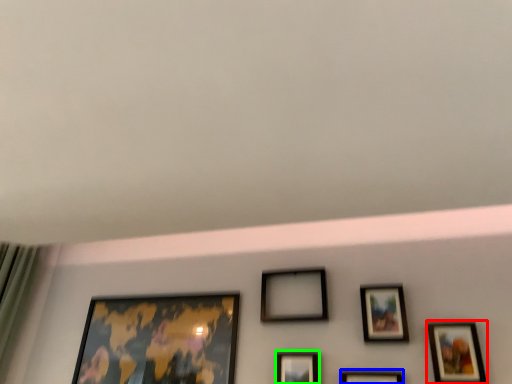
Question: Which object is positioned farthest from picture frame (highlighted by a red box)? Select from picture frame (highlighted by a blue box) and picture frame (highlighted by a green box).

Choices:
 (A) picture frame
 (B) picture frame

Answer: (B)